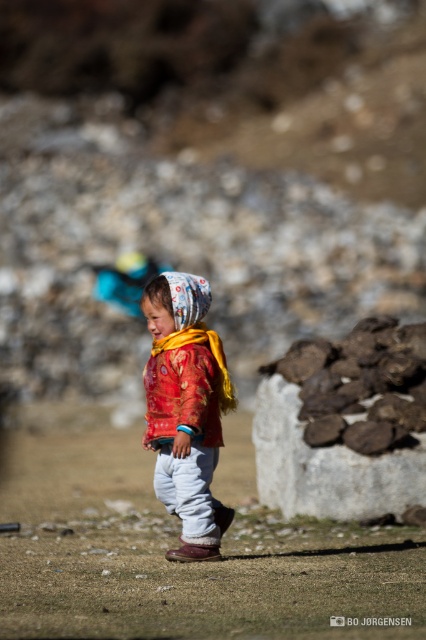
Does point (282, 440) come farther from viewer compared to point (216, 349)?

That is True.

Can you confirm if dark brown rock at center is positioned below matte red jacket at center?

Yes, dark brown rock at center is below matte red jacket at center.

Which is in front, point (417, 369) or point (186, 321)?

Point (186, 321)

At what (x,y) coordinates should I click in order to perform the action: click on dark brown rock at center. Please return your answer as a coordinate pair (x, y). The width and height of the screenshot is (426, 640). Looking at the image, I should click on (345, 422).

Which is below, matte red jacket at center or printed fabric headscarf at center?

matte red jacket at center

Between matte red jacket at center and printed fabric headscarf at center, which one is positioned higher?

Positioned higher is printed fabric headscarf at center.

Is point (204, 417) less distant than point (201, 314)?

Yes, it is in front of point (201, 314).

Identify the location of matte red jacket at center. (186, 408).

Between matte red jacket at center and red fabric shawl at center, which one has more height?

matte red jacket at center

Is matte red jacket at center further to the viewer compared to red fabric shawl at center?

That is False.

Is point (227, 403) positioned behind point (152, 353)?

Yes, point (227, 403) is farther from viewer.

Where is `matte red jacket at center`? matte red jacket at center is located at coordinates (186, 408).